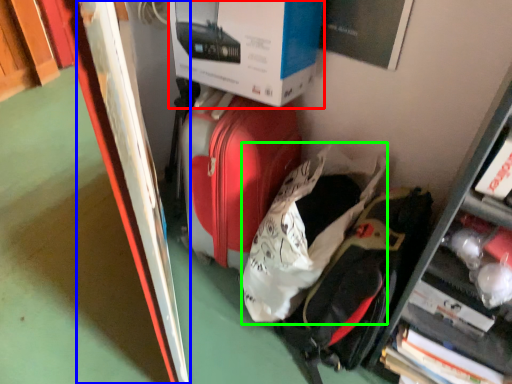
Question: Estimate the real-world distances between objects in this image. Which object is farther from box (highlighted by a red box), bulletin board (highlighted by a blue box) or luggage (highlighted by a green box)?

Choices:
 (A) bulletin board
 (B) luggage

Answer: (B)